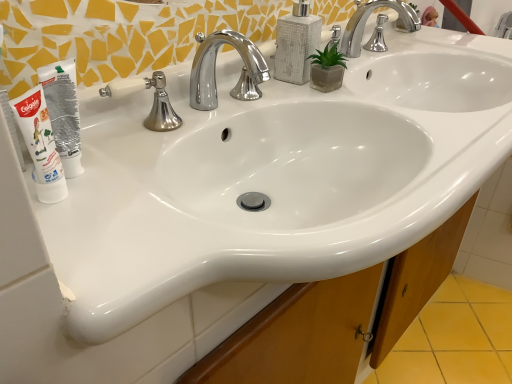
Image resolution: width=512 pixels, height=384 pixels. In order to click on free location in front of white textured soap dispenser at upper center in this screenshot , I will do `click(308, 106)`.